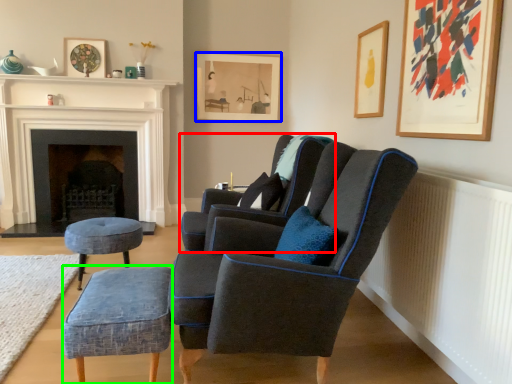
Question: Which object is the closest to the chair (highlighted by a red box)? Choose among these: picture frame (highlighted by a blue box) or stool (highlighted by a green box).

Choices:
 (A) picture frame
 (B) stool

Answer: (B)